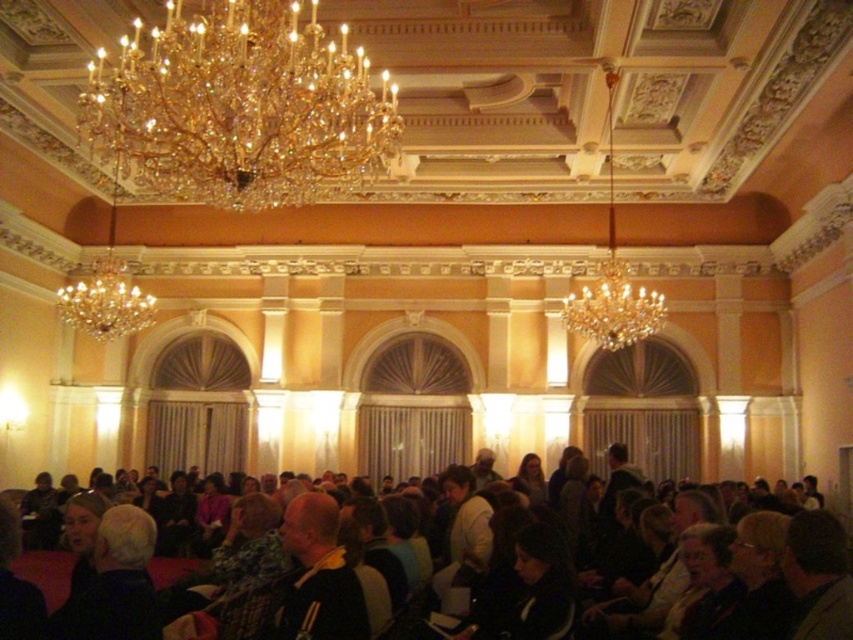
You are a guest at this event and want to take a photo of the crystal glass chandelier at upper left and the dark brown hair at center. Which object should you focus on first if you want to capture both in one shot without moving the camera?

You should focus on the crystal glass chandelier at upper left first because it is larger in size than the dark brown hair at center, so it will require more attention in the frame.

In the scene shown: You are a guest at the event and want to take a photo of the gold crystal chandelier at upper center and the crystal glass chandelier at center. Which one do you need to look up more to capture in your photo?

The gold crystal chandelier at upper center is much taller than the crystal glass chandelier at center, so you need to look up more to capture the gold crystal chandelier at upper center in your photo.

You are standing in the grand room and want to know how far the point at coordinates point (268, 140) is from you. Can you determine the distance?

The point (268, 140) is 33.17 meters from the camera, so the distance is 33.17 meters.